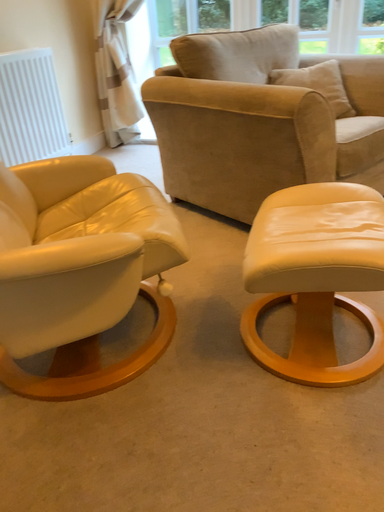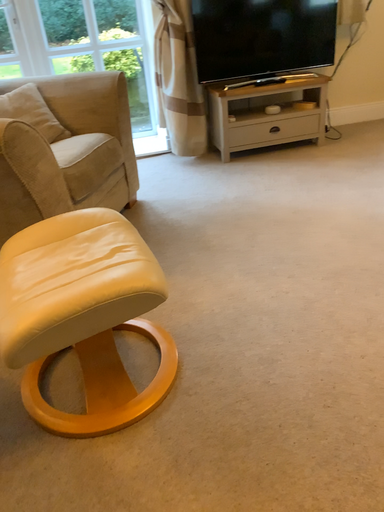
Question: Which way did the camera rotate in the video?

Choices:
 (A) rotated downward
 (B) rotated upward

Answer: (B)